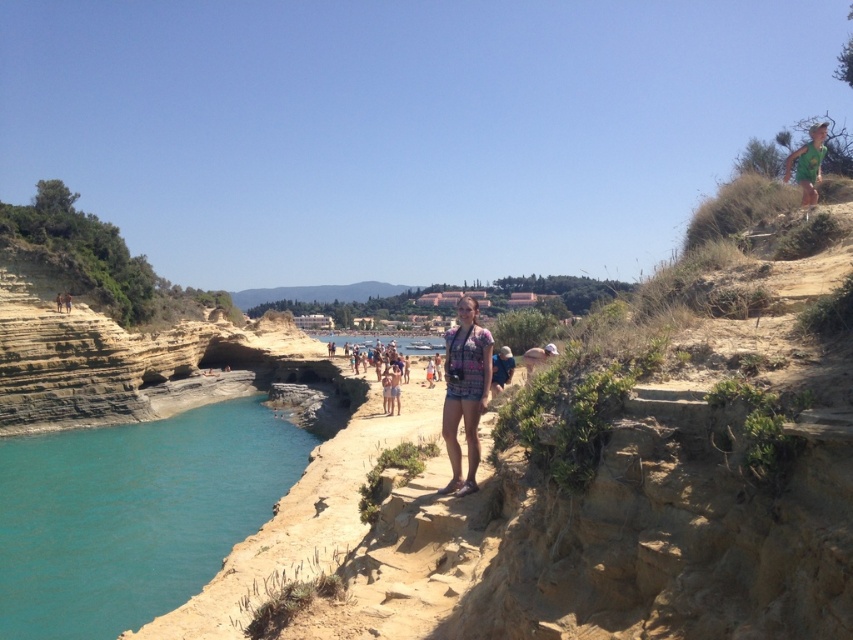
From the picture: You are a photographer positioned at the cliff edge trying to capture both points marked in the scene. Which point, point [474,438] or point [508,378], will appear larger in your photo?

Point [474,438] will appear larger in the photo because it is closer to the camera than point [508,378].

You are a photographer trying to capture the person at the center of the image. Since you want to focus on their clothing, you need to know which item is narrower. Which one is narrower between the pink floral shorts at center and the plaid shirt at center?

The pink floral shorts at center is narrower than the plaid shirt at center, as the pink floral shorts at center has a smaller width according to the description.

You are a photographer planning to take a photo of the turquoise water at lower left and the green fabric shorts at upper right. Which object will appear closer to the camera in the photo?

The turquoise water at lower left appears closer to the camera because it is positioned in front of the green fabric shorts at upper right.